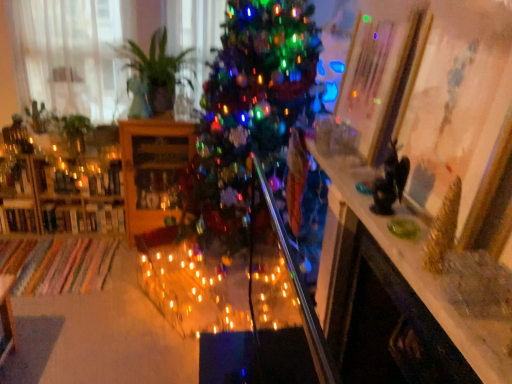
Question: Can you confirm if green glossy plant at upper left is positioned to the right of white sheer curtain at left?

Choices:
 (A) no
 (B) yes

Answer: (B)

Question: Does green glossy plant at upper left turn towards white sheer curtain at left?

Choices:
 (A) yes
 (B) no

Answer: (B)

Question: Is there a large distance between green glossy plant at upper left and white sheer curtain at left?

Choices:
 (A) yes
 (B) no

Answer: (B)

Question: From a real-world perspective, is green glossy plant at upper left on white sheer curtain at left?

Choices:
 (A) yes
 (B) no

Answer: (A)

Question: From a real-world perspective, is green glossy plant at upper left under white sheer curtain at left?

Choices:
 (A) no
 (B) yes

Answer: (A)

Question: Is white sheer curtain at left inside or outside of shiny metallic table at upper right?

Choices:
 (A) outside
 (B) inside

Answer: (A)

Question: From a real-world perspective, is white sheer curtain at left physically located above or below shiny metallic table at upper right?

Choices:
 (A) below
 (B) above

Answer: (B)

Question: From the image's perspective, relative to shiny metallic table at upper right, is white sheer curtain at left above or below?

Choices:
 (A) above
 (B) below

Answer: (A)

Question: Does point (106, 56) appear closer or farther from the camera than point (478, 327)?

Choices:
 (A) closer
 (B) farther

Answer: (B)

Question: From the image's perspective, is wooden bookshelf at left, which appears as the 2th shelf when viewed from the right, positioned above or below green glossy plant at upper left?

Choices:
 (A) below
 (B) above

Answer: (A)

Question: Is wooden bookshelf at left, arranged as the first shelf when viewed from the left, to the left or to the right of green glossy plant at upper left in the image?

Choices:
 (A) left
 (B) right

Answer: (A)

Question: From their relative heights in the image, would you say wooden bookshelf at left, arranged as the first shelf when viewed from the left, is taller or shorter than green glossy plant at upper left?

Choices:
 (A) short
 (B) tall

Answer: (B)

Question: Looking at their shapes, would you say wooden bookshelf at left, which appears as the 2th shelf when viewed from the right, is wider or thinner than green glossy plant at upper left?

Choices:
 (A) wide
 (B) thin

Answer: (B)

Question: In the image, is wooden bookshelf at left, which appears as the 2th shelf when viewed from the right, positioned in front of or behind shiny metallic table at upper right?

Choices:
 (A) behind
 (B) front

Answer: (A)

Question: Considering the positions of point (111, 173) and point (414, 258), is point (111, 173) closer or farther from the camera than point (414, 258)?

Choices:
 (A) closer
 (B) farther

Answer: (B)